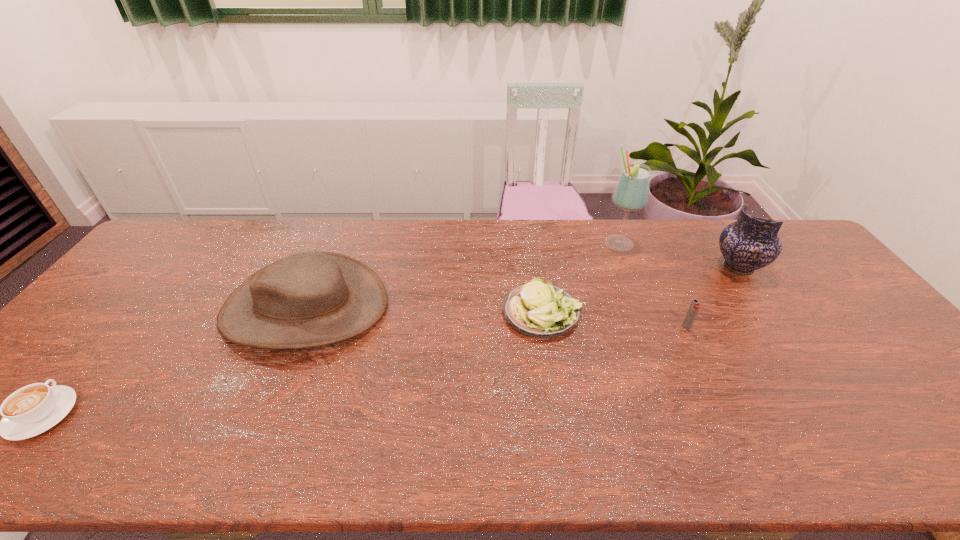
The height and width of the screenshot is (540, 960). Find the location of `blank space located 0.180m on the right of the third object from right to left`. blank space located 0.180m on the right of the third object from right to left is located at coordinates (x=690, y=244).

This screenshot has height=540, width=960. Identify the location of vacant space located on the right of the pottery. pyautogui.click(x=780, y=267).

This screenshot has height=540, width=960. In order to click on blank space located on the right of the third tallest object in this screenshot , I will do `click(482, 307)`.

You are a GUI agent. You are given a task and a screenshot of the screen. Output one action in this format:
    pyautogui.click(x=<x>, y=<y>)
    Task: Click on the free space located 0.210m on the front of the igniter
    Image resolution: width=960 pixels, height=540 pixels.
    Given the screenshot: What is the action you would take?
    pyautogui.click(x=720, y=399)

You are a GUI agent. You are given a task and a screenshot of the screen. Output one action in this format:
    pyautogui.click(x=<x>, y=<y>)
    Task: Click on the vacant region located on the back of the lettuce
    This screenshot has width=960, height=540.
    Given the screenshot: What is the action you would take?
    pyautogui.click(x=533, y=251)

The image size is (960, 540). Find the location of `alcohol present at the far edge`. alcohol present at the far edge is located at coordinates click(631, 193).

This screenshot has width=960, height=540. In order to click on pottery that is at the far edge in this screenshot , I will do `click(750, 243)`.

Find the location of a particular element. Image resolution: width=960 pixels, height=540 pixels. free space at the far edge of the desktop is located at coordinates (373, 234).

You are a GUI agent. You are given a task and a screenshot of the screen. Output one action in this format:
    pyautogui.click(x=<x>, y=<y>)
    Task: Click on the free location at the near edge of the desktop
    This screenshot has height=540, width=960.
    Given the screenshot: What is the action you would take?
    pyautogui.click(x=761, y=468)

Image resolution: width=960 pixels, height=540 pixels. In the image, there is a desktop. Find the location of `vacant space at the left edge`. vacant space at the left edge is located at coordinates (90, 358).